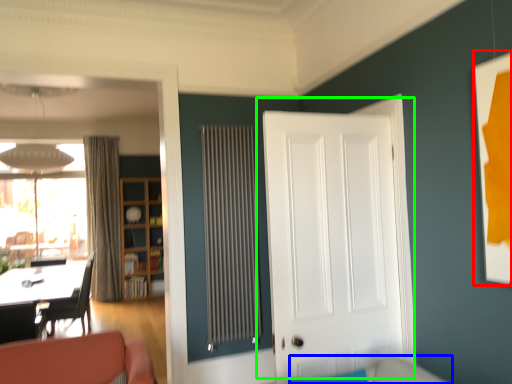
Question: Which object is the closest to the picture frame (highlighted by a red box)? Choose among these: couch (highlighted by a blue box) or door (highlighted by a green box).

Choices:
 (A) couch
 (B) door

Answer: (B)